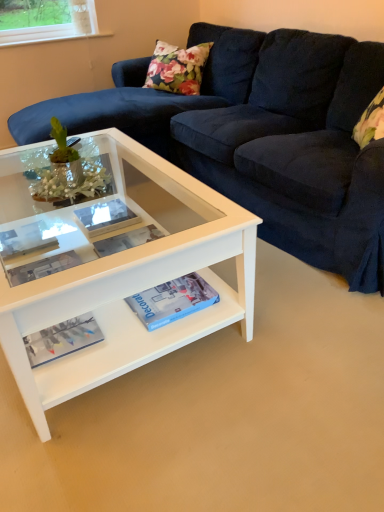
The image size is (384, 512). Identify the location of empty space that is ontop of matte white book at center (from a real-world perspective). (17, 239).